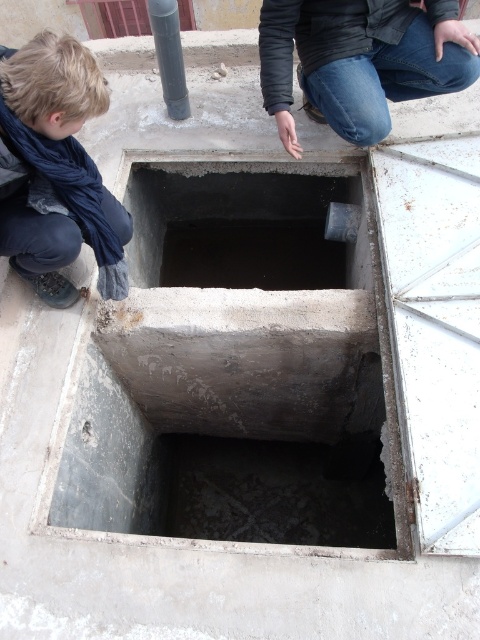
Question: In this image, where is blue scarf at lower left located relative to smooth gray pole at upper left?

Choices:
 (A) left
 (B) right

Answer: (A)

Question: Which object is closer to the camera taking this photo?

Choices:
 (A) blue denim jeans at upper center
 (B) blue scarf at lower left

Answer: (B)

Question: Which of the following is the closest to the observer?

Choices:
 (A) smooth gray pole at upper left
 (B) blue denim jeans at upper center

Answer: (B)

Question: Does concrete manhole at center have a greater width compared to smooth gray pole at upper left?

Choices:
 (A) yes
 (B) no

Answer: (A)

Question: Among these points, which one is nearest to the camera?

Choices:
 (A) (191, 193)
 (B) (324, 51)

Answer: (B)

Question: Is blue scarf at lower left wider than smooth gray pole at upper left?

Choices:
 (A) no
 (B) yes

Answer: (B)